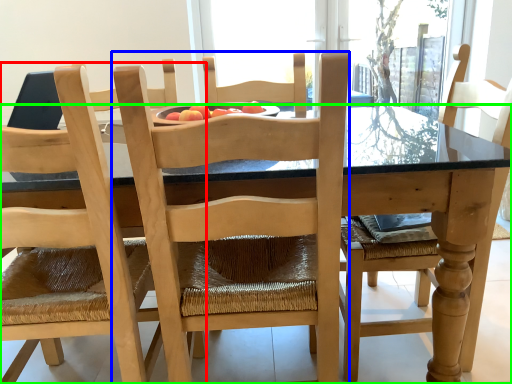
Question: Based on their relative distances, which object is nearer to chair (highlighted by a red box)? Choose from chair (highlighted by a blue box) and kitchen & dining room table (highlighted by a green box).

Choices:
 (A) chair
 (B) kitchen & dining room table

Answer: (A)